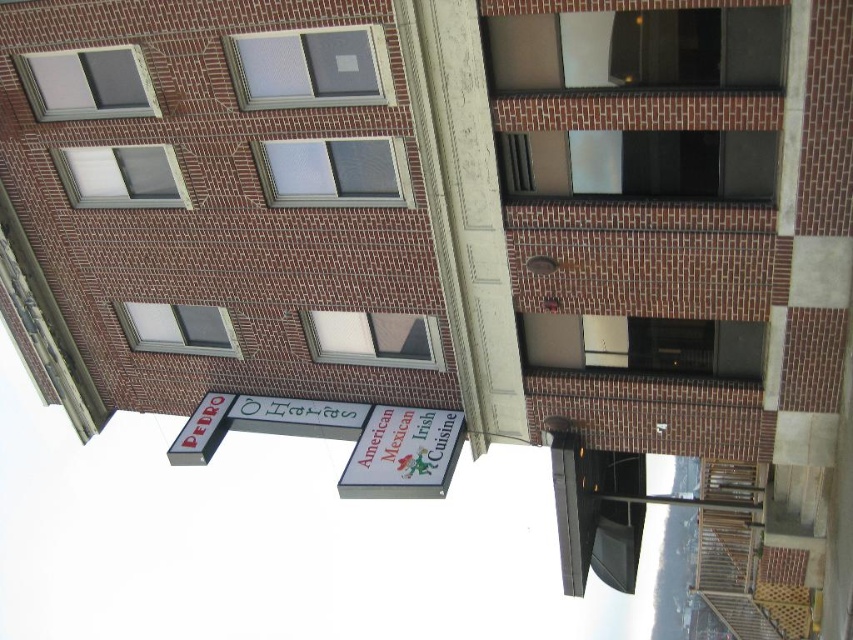
Question: Which point appears farthest from the camera in this image?

Choices:
 (A) click(x=202, y=442)
 (B) click(x=419, y=476)

Answer: (A)

Question: Does white plastic sign at lower center have a lesser width compared to metallic silver sign at left?

Choices:
 (A) yes
 (B) no

Answer: (B)

Question: Which of the following is the farthest from the observer?

Choices:
 (A) metallic silver sign at left
 (B) white plastic sign at lower center

Answer: (A)

Question: In this image, where is white plastic sign at lower center located relative to metallic silver sign at left?

Choices:
 (A) below
 (B) above

Answer: (A)

Question: Can you confirm if white plastic sign at lower center is smaller than metallic silver sign at left?

Choices:
 (A) no
 (B) yes

Answer: (A)